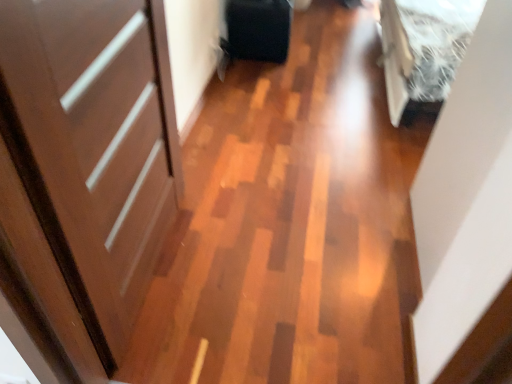
Where is `free point behind matte brown door at left`? free point behind matte brown door at left is located at coordinates (228, 180).